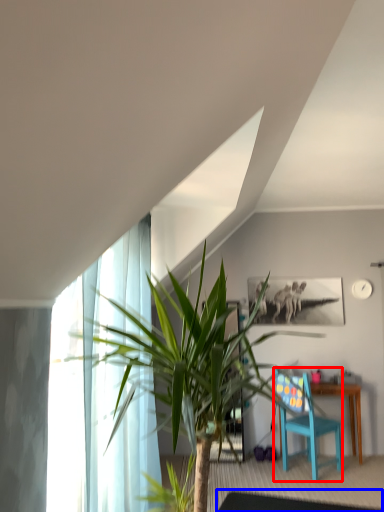
Question: Among these objects, which one is farthest to the camera, chair (highlighted by a red box) or glass table (highlighted by a blue box)?

Choices:
 (A) chair
 (B) glass table

Answer: (A)